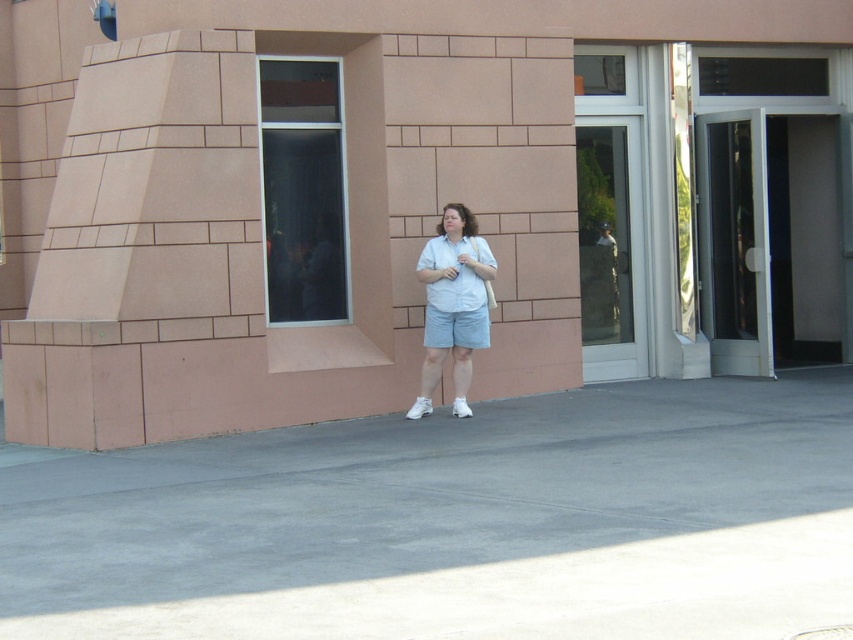
Question: Which of the following is the farthest from the observer?

Choices:
 (A) (480, 406)
 (B) (422, 394)
 (C) (432, 250)

Answer: (A)

Question: Can you confirm if gray concrete pavement at center is positioned below light blue cotton shirt at center?

Choices:
 (A) yes
 (B) no

Answer: (A)

Question: Does light blue denim shorts at center appear on the right side of light blue cotton shirt at center?

Choices:
 (A) no
 (B) yes

Answer: (A)

Question: Which point is farther to the camera?

Choices:
 (A) gray concrete pavement at center
 (B) light blue cotton shirt at center
 (C) light blue denim shorts at center

Answer: (B)

Question: Is gray concrete pavement at center in front of light blue cotton shirt at center?

Choices:
 (A) no
 (B) yes

Answer: (B)

Question: Among these points, which one is farthest from the camera?

Choices:
 (A) (468, 257)
 (B) (440, 252)

Answer: (B)